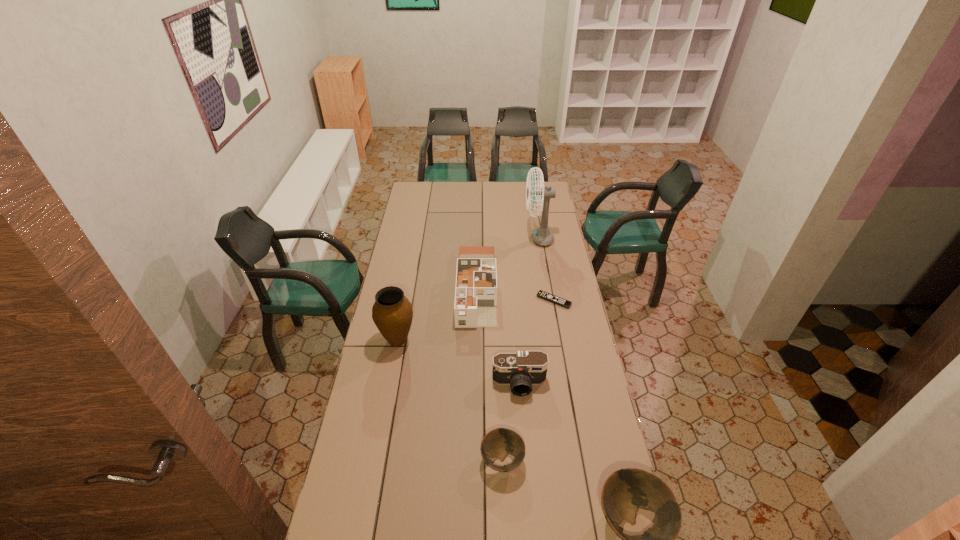
Find the location of `blank space located 0.310m at the entrance of the dollhouse`. blank space located 0.310m at the entrance of the dollhouse is located at coordinates [x=476, y=387].

You are a GUI agent. You are given a task and a screenshot of the screen. Output one action in this format:
    pyautogui.click(x=<x>, y=<y>)
    Task: Click on the vacant space located 0.360m on the back of the shortest object
    The height and width of the screenshot is (540, 960).
    Given the screenshot: What is the action you would take?
    pyautogui.click(x=544, y=247)

Where is `free space located 0.180m on the front-facing side of the fan`? Image resolution: width=960 pixels, height=540 pixels. free space located 0.180m on the front-facing side of the fan is located at coordinates (492, 238).

I want to click on vacant space located on the front-facing side of the fan, so (500, 238).

Locate an element on the screen. The width and height of the screenshot is (960, 540). free space located on the front-facing side of the fan is located at coordinates (483, 238).

Find the location of a particular element. The height and width of the screenshot is (540, 960). vacant space located on the front-facing side of the fifth farthest object is located at coordinates (524, 445).

Locate an element on the screen. The height and width of the screenshot is (540, 960). vacant region located 0.290m on the front of the sixth shortest object is located at coordinates (383, 418).

Locate an element on the screen. The height and width of the screenshot is (540, 960). object situated at the left edge is located at coordinates (392, 313).

What are the coordinates of `remote control that is positioned at the right edge` in the screenshot? It's located at (560, 301).

Locate an element on the screen. fan located in the right edge section of the desktop is located at coordinates (542, 235).